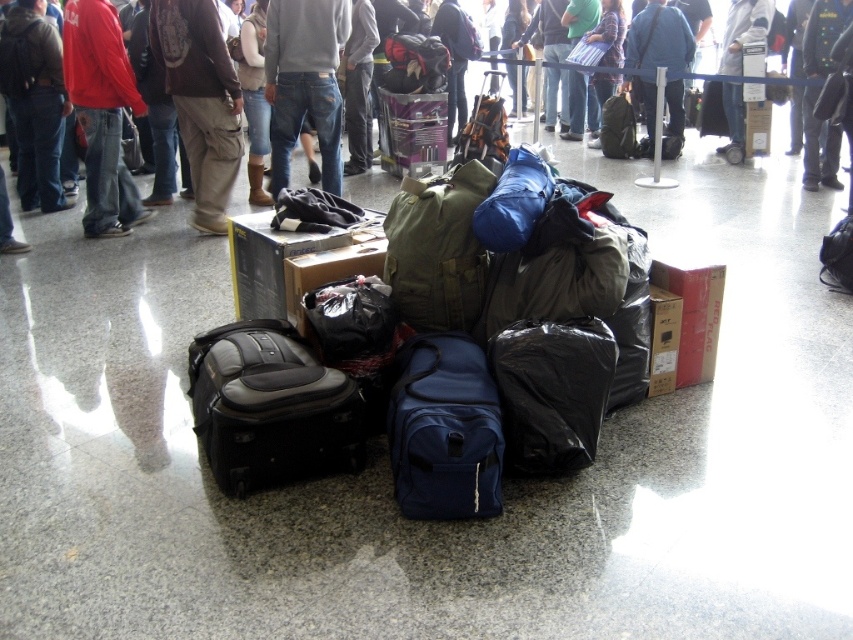
You are a delivery person who needs to move a package from the navy blue fabric backpack at center to the matte black backpack at center. Given that your cart can only carry items within a 4 meter range, will you be able to move the package directly without needing to adjust the backpack positions?

The distance between the navy blue fabric backpack at center and the matte black backpack at center is 4.28 meters. Since the cart can only carry items within a 4 meter range, you will need to adjust the backpack positions to reduce the distance before moving the package directly.

You are a baggage handler at an airport. You need to stack the matte black suitcase at center and the red cotton hoodie at upper left on a shelf. Which item should you place first to ensure stability?

The matte black suitcase at center should be placed first because it has a lesser height compared to the red cotton hoodie at upper left, allowing the taller item to be placed on top for stability.